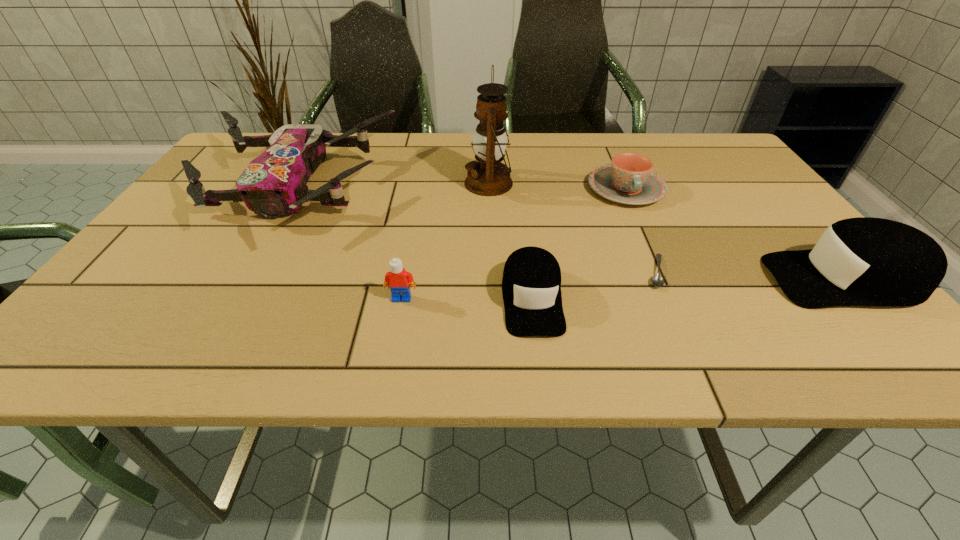
Locate an element on the screen. the shorter cap is located at coordinates (531, 285).

Locate an element on the screen. The height and width of the screenshot is (540, 960). the right cap is located at coordinates (864, 261).

Identify the location of the taller cap. (864, 261).

Locate an element on the screen. chinaware is located at coordinates (629, 179).

Identify the location of the leftmost object. The width and height of the screenshot is (960, 540). (274, 184).

The height and width of the screenshot is (540, 960). Identify the location of the shortest object. (657, 280).

Find the location of a particular element. Image resolution: width=960 pixels, height=540 pixels. the tallest object is located at coordinates (488, 177).

Locate an element on the screen. The width and height of the screenshot is (960, 540). the sixth object from right to left is located at coordinates (398, 279).

At what (x,y) coordinates should I click in order to perform the action: click on free spot located 0.310m on the front-facing side of the rightmost object. Please return your answer as a coordinate pair (x, y). Looking at the image, I should click on (616, 279).

The image size is (960, 540). What are the coordinates of `vacant space located 0.150m on the front-facing side of the rightmost object` in the screenshot? It's located at (695, 279).